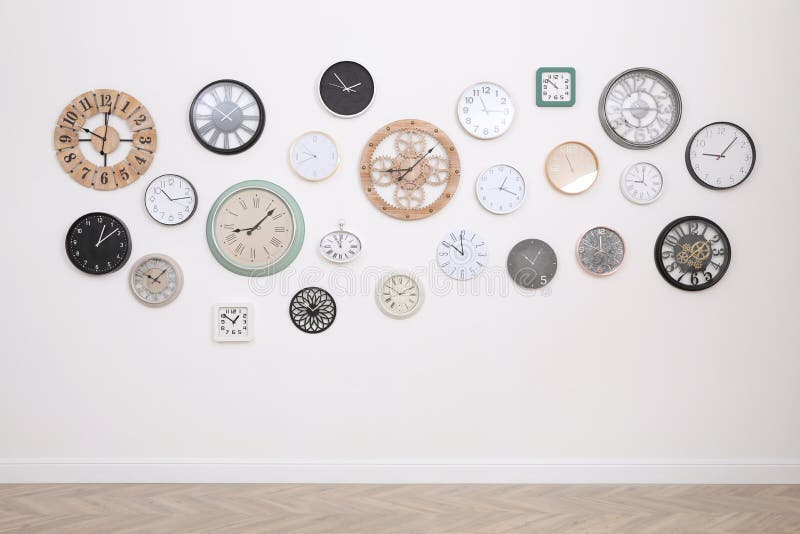
Locate an element on the screen. This screenshot has width=800, height=534. clocks with roman numerals is located at coordinates click(x=256, y=234), click(x=154, y=282), click(x=230, y=127), click(x=341, y=258), click(x=412, y=292).